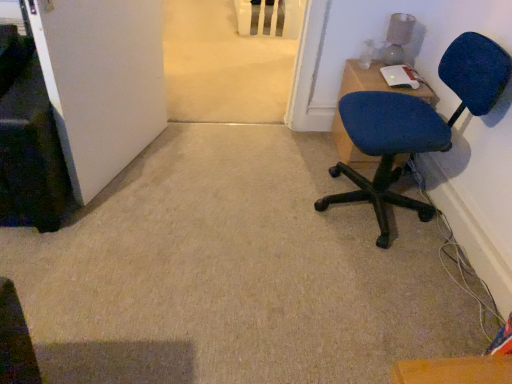
I want to click on free area below white matte door at lower left (from a real-world perspective), so click(125, 162).